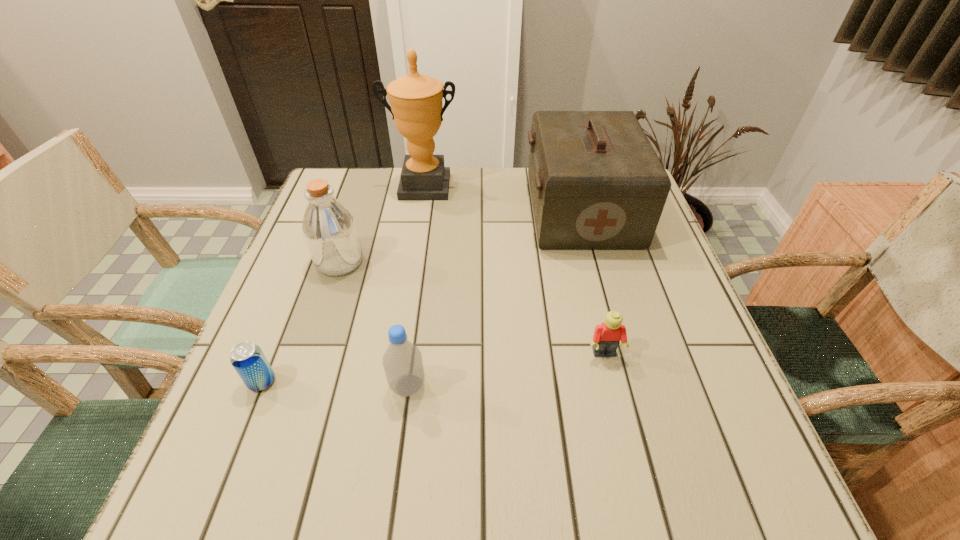
The image size is (960, 540). In order to click on award in this screenshot , I will do `click(416, 99)`.

The image size is (960, 540). What are the coordinates of `the first-aid kit` in the screenshot? It's located at (596, 182).

Find the location of a particular element. The width and height of the screenshot is (960, 540). the farther bottle is located at coordinates (329, 229).

This screenshot has width=960, height=540. I want to click on the left bottle, so click(329, 229).

Identify the location of the right bottle. click(x=402, y=361).

Where is `the third shortest object`? the third shortest object is located at coordinates (402, 361).

The width and height of the screenshot is (960, 540). Identify the location of the fourth farthest object. (607, 336).

This screenshot has width=960, height=540. I want to click on the shortest object, so click(x=248, y=360).

Where is `vacant space located at the front of the tallest object with handles`? vacant space located at the front of the tallest object with handles is located at coordinates (404, 309).

Find the location of a particular element. free spot located on the front of the first-aid kit is located at coordinates (621, 357).